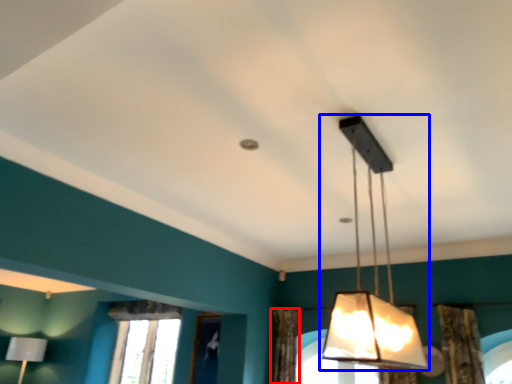
Question: Which object appears farthest to the camera in this image, curtain (highlighted by a red box) or lamp (highlighted by a blue box)?

Choices:
 (A) curtain
 (B) lamp

Answer: (A)